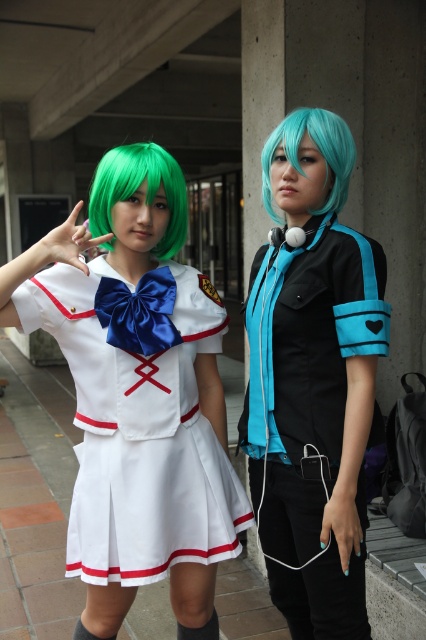
Which is more to the right, matte black shirt at center or teal glossy wig at center?

Positioned to the right is teal glossy wig at center.

Looking at this image, is matte black shirt at center to the left of teal glossy wig at center from the viewer's perspective?

Correct, you'll find matte black shirt at center to the left of teal glossy wig at center.

Identify the location of matte black shirt at center. (313, 380).

Identify the location of matte black shirt at center. This screenshot has width=426, height=640. (313, 380).

Can you confirm if matte white dress at center is shorter than green matte wig at left?

Incorrect, matte white dress at center's height does not fall short of green matte wig at left's.

Which of these two, matte white dress at center or green matte wig at left, stands shorter?

green matte wig at left is shorter.

Which is behind, point (97, 186) or point (175, 220)?

The point (175, 220) is more distant.

The height and width of the screenshot is (640, 426). I want to click on matte white dress at center, so click(138, 394).

Is green matte wig at left taller than teal glossy wig at center?

Correct, green matte wig at left is much taller as teal glossy wig at center.

Who is more forward, (x=181, y=216) or (x=336, y=204)?

Point (x=336, y=204)

Where is `green matte wig at left`? The width and height of the screenshot is (426, 640). green matte wig at left is located at coordinates (137, 188).